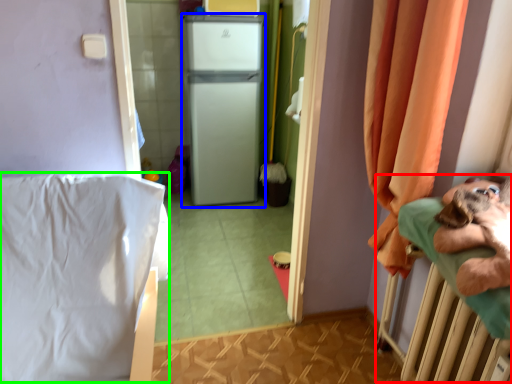
Question: Which is nearer to the hospital bed (highlighted by a red box)? appliance (highlighted by a blue box) or sheet (highlighted by a green box).

Choices:
 (A) appliance
 (B) sheet

Answer: (B)